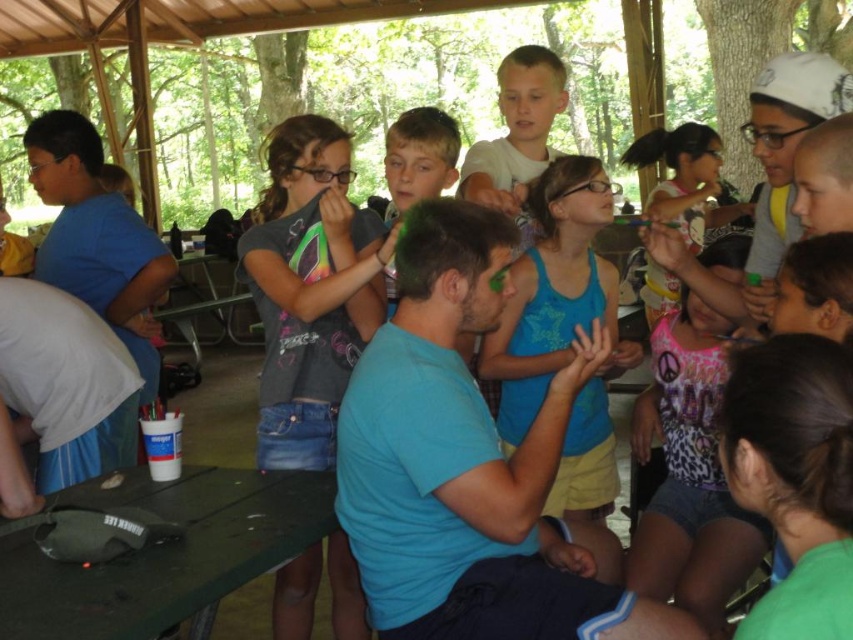
In the scene described, there is a green matte fanny pack at lower left and a blue cotton tank top at center. From the perspective of someone standing at the picnic table, which item is positioned to the left of the other?

The green matte fanny pack at lower left is to the left of the blue cotton tank top at center.

You are a photographer at the event and want to ensure both the blue cotton tank top at center and the pink leopard print tank top at center are clearly visible in your photo. Given their sizes, which tank top might you need to position closer to the camera to maintain clarity?

The pink leopard print tank top at center is smaller in size compared to the blue cotton tank top at center. To ensure both are clearly visible, you might need to position the pink leopard print tank top at center closer to the camera since it is smaller and could appear less detailed from a distance.

Looking at the children gathered around the picnic table, which child is wearing the blue cotton tank top at center relative to the one in the pink leopard print tank top at center?

The blue cotton tank top at center is to the left of the pink leopard print tank top at center.